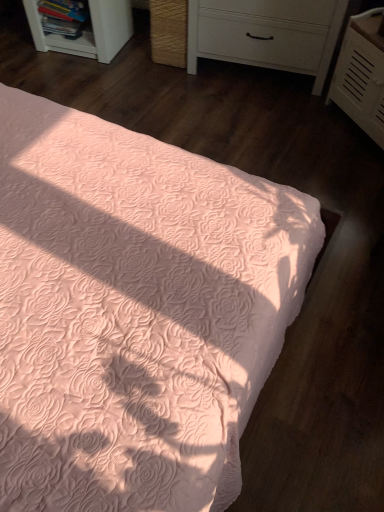
The width and height of the screenshot is (384, 512). What are the coordinates of `vacant space that's between white textured chest of drawers at upper right, which ranks as the 1th chest of drawers in right-to-left order, and white matte chest of drawers at upper center, which is the second chest of drawers in right-to-left order` in the screenshot? It's located at (285, 108).